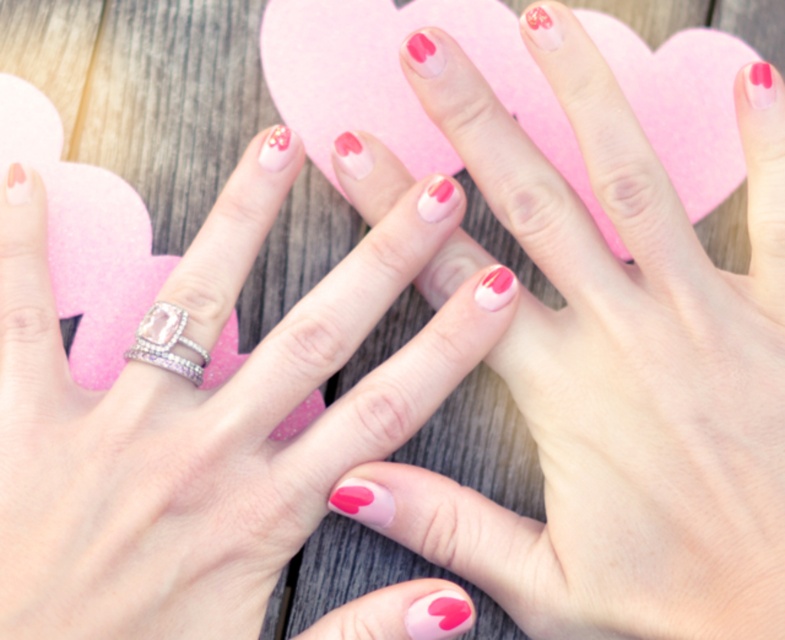
Between point (344, 180) and point (261, 476), which one is positioned in front?

Point (261, 476) is in front.

This screenshot has width=785, height=640. Find the location of `pink matte nails at center`. pink matte nails at center is located at coordinates (615, 371).

Which is behind, point (769, 461) or point (68, 598)?

Positioned behind is point (769, 461).

The height and width of the screenshot is (640, 785). I want to click on pink matte nails at center, so click(x=615, y=371).

Can you confirm if matte pink nail polish at center is positioned to the right of clear crystal ring at center?

Indeed, matte pink nail polish at center is positioned on the right side of clear crystal ring at center.

Does matte pink nail polish at center appear under clear crystal ring at center?

Correct, matte pink nail polish at center is located below clear crystal ring at center.

Between point (375, 426) and point (192, 348), which one is positioned in front?

Point (192, 348)

Where is `matte pink nail polish at center`? matte pink nail polish at center is located at coordinates (203, 435).

Measure the distance from matte pink nail polish at center to pink matte heart at center.

They are 15.42 centimeters apart.

Which is in front, point (2, 538) or point (411, 120)?

Positioned in front is point (2, 538).

Image resolution: width=785 pixels, height=640 pixels. Find the location of `matte pink nail polish at center`. matte pink nail polish at center is located at coordinates (x=203, y=435).